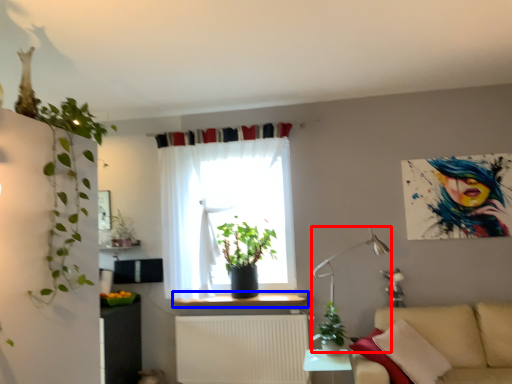
Question: Which point is closer to the camera, table lamp (highlighted by a red box) or window sill (highlighted by a blue box)?

Choices:
 (A) table lamp
 (B) window sill

Answer: (A)